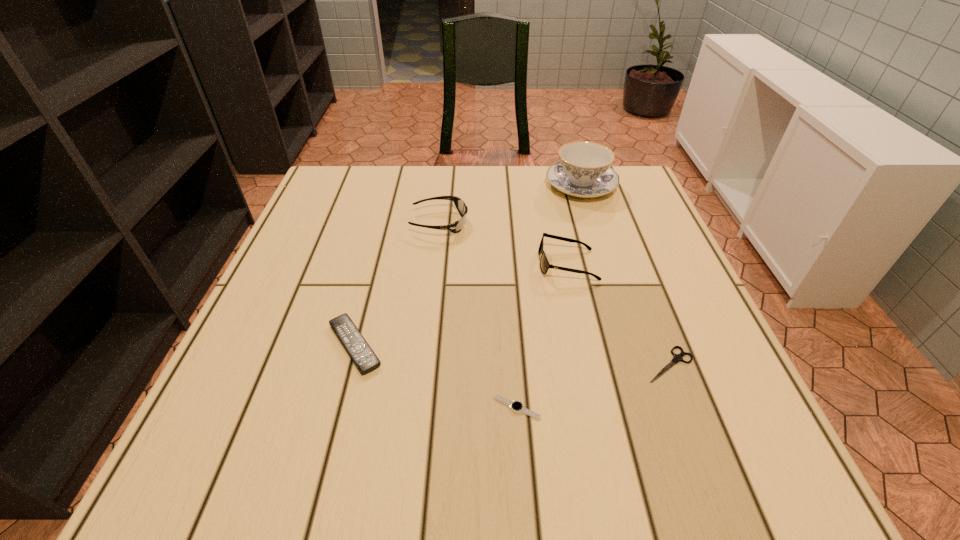
I want to click on object present at the left edge, so click(x=363, y=356).

Where is `chinaware that is at the right edge`? Image resolution: width=960 pixels, height=540 pixels. chinaware that is at the right edge is located at coordinates (584, 170).

The height and width of the screenshot is (540, 960). Find the location of `shears that is at the right edge`. shears that is at the right edge is located at coordinates (677, 358).

The width and height of the screenshot is (960, 540). Find the location of `object present at the far right corner`. object present at the far right corner is located at coordinates (584, 170).

The width and height of the screenshot is (960, 540). What are the coordinates of `vacant space at the far edge of the desktop` in the screenshot? It's located at (469, 190).

In the image, there is a desktop. At what (x,y) coordinates should I click in order to perform the action: click on vacant space at the near edge. Please return your answer as a coordinate pair (x, y). Looking at the image, I should click on (492, 468).

Where is `vacant region at the left edge of the desktop`? vacant region at the left edge of the desktop is located at coordinates (296, 279).

Where is `free space at the right edge of the desktop`? This screenshot has height=540, width=960. free space at the right edge of the desktop is located at coordinates [671, 253].

Identify the location of vacant space at the far left corner. Image resolution: width=960 pixels, height=540 pixels. (376, 172).

The image size is (960, 540). I want to click on free space at the near left corner of the desktop, so click(x=282, y=484).